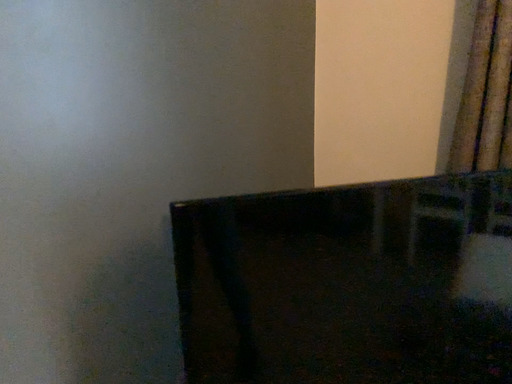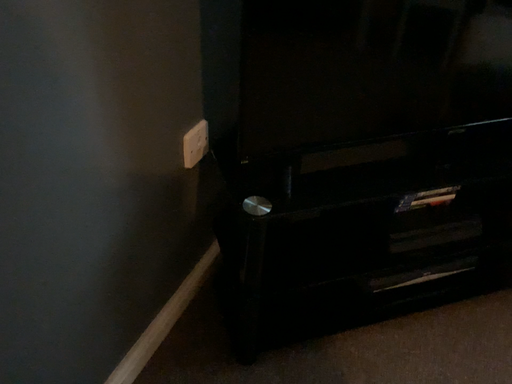
Question: Which way did the camera rotate in the video?

Choices:
 (A) rotated right
 (B) rotated left

Answer: (A)